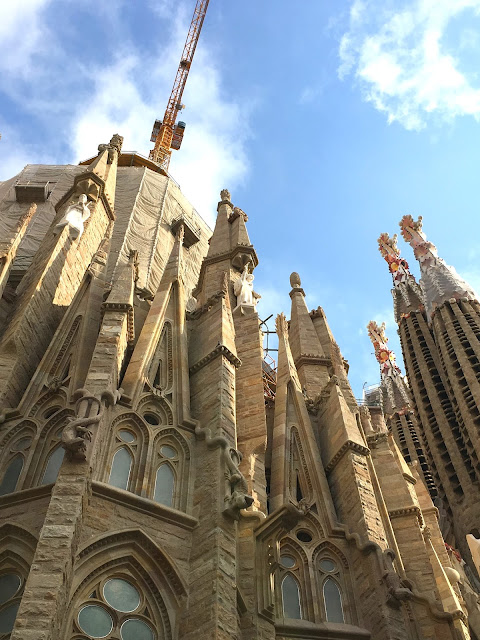
Where is `window`? This screenshot has width=480, height=640. window is located at coordinates (128, 598), (85, 627), (138, 630), (288, 598), (331, 598), (163, 477), (122, 470), (55, 458).